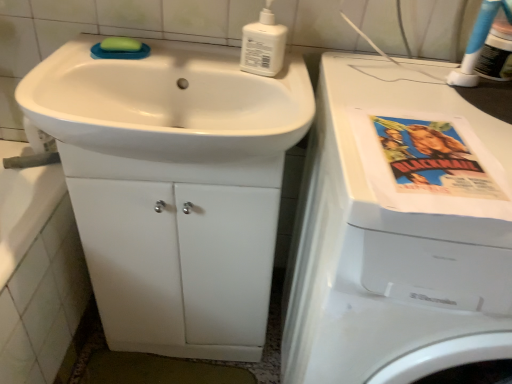
What are the coordinates of `free point to the left of white plastic bottle at upper center` in the screenshot? It's located at (198, 63).